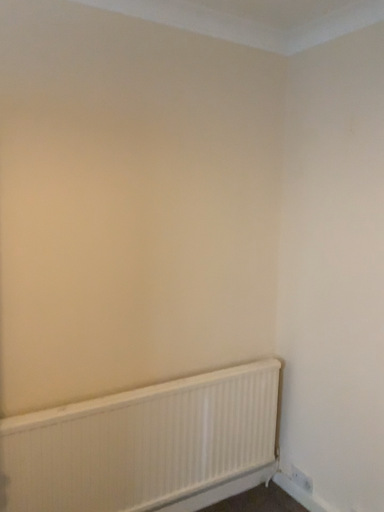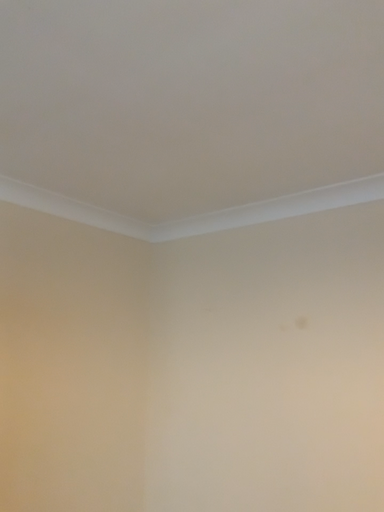
Question: How did the camera likely rotate when shooting the video?

Choices:
 (A) rotated downward
 (B) rotated upward

Answer: (B)